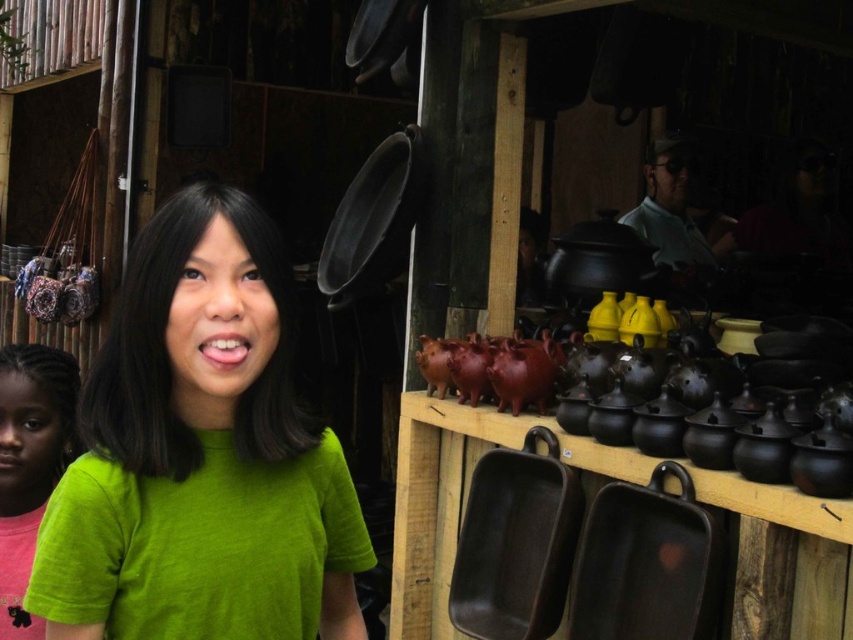
Question: Is green fabric shirt at center closer to camera compared to green matte shirt at left?

Choices:
 (A) yes
 (B) no

Answer: (A)

Question: Which point is closer to the camera?

Choices:
 (A) green matte shirt at left
 (B) green fabric shirt at center

Answer: (B)

Question: Does green fabric shirt at center appear under green matte shirt at left?

Choices:
 (A) no
 (B) yes

Answer: (A)

Question: Among these points, which one is farthest from the camera?

Choices:
 (A) (254, 595)
 (B) (50, 392)

Answer: (B)

Question: Which object is closer to the camera taking this photo?

Choices:
 (A) green fabric shirt at center
 (B) green matte shirt at left

Answer: (A)

Question: Can you confirm if green fabric shirt at center is thinner than green matte shirt at left?

Choices:
 (A) no
 (B) yes

Answer: (A)